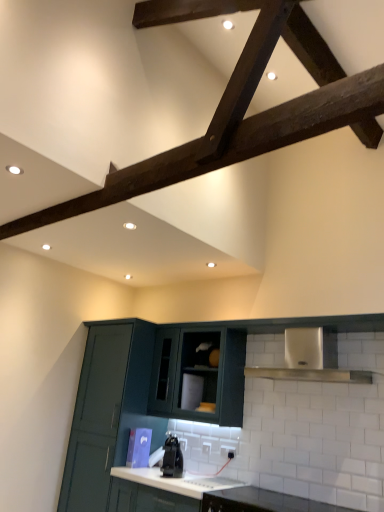
Identify the location of vacant space underneath black glossy kettle at center (from a real-world perspective). (174, 476).